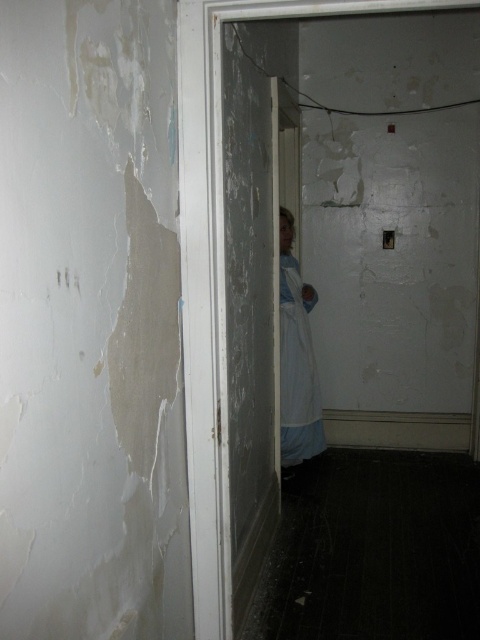
Who is lower down, white matte door at center or white fabric dress at center?

white fabric dress at center is lower down.

Where is `white matte door at center`? This screenshot has height=640, width=480. white matte door at center is located at coordinates (218, 275).